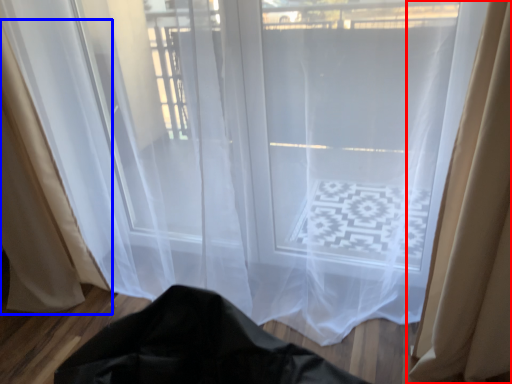
Question: Which point is further to the camera, curtain (highlighted by a red box) or curtain (highlighted by a blue box)?

Choices:
 (A) curtain
 (B) curtain

Answer: (B)